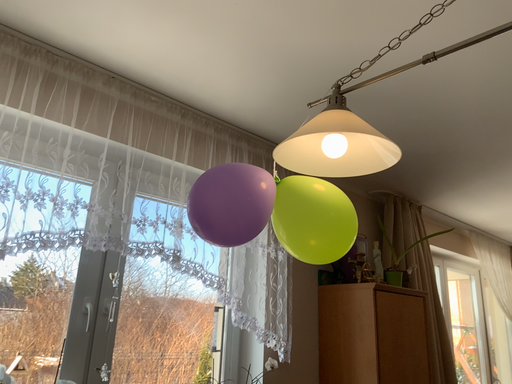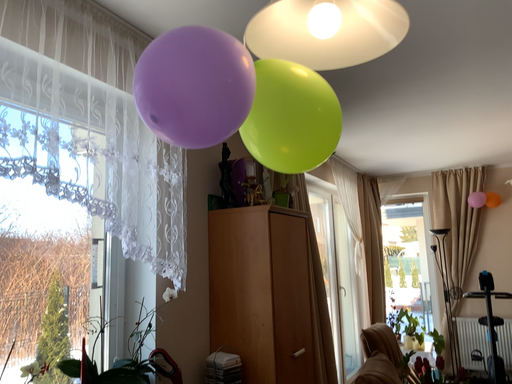
Question: How did the camera likely rotate when shooting the video?

Choices:
 (A) rotated left
 (B) rotated right

Answer: (B)